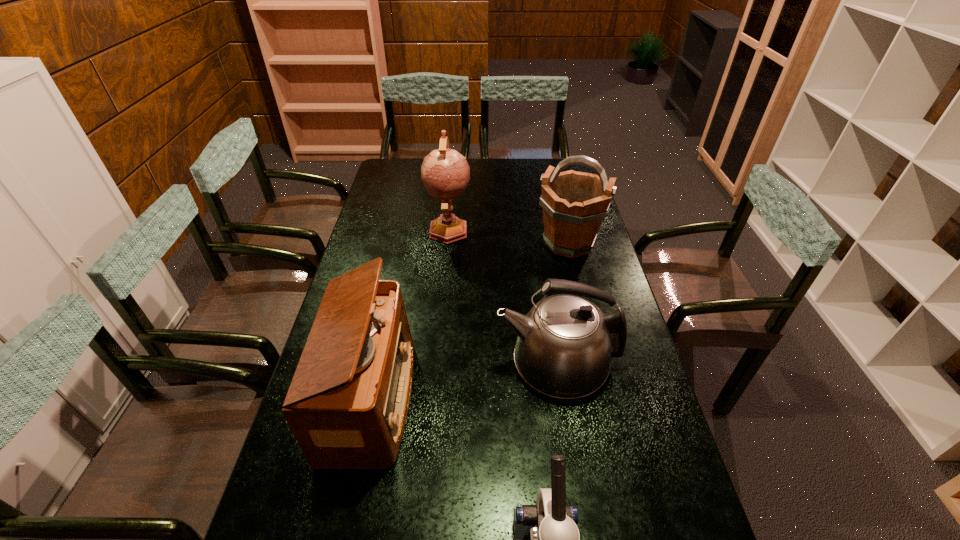
Identify which object is the third nearest to the kettle. Please provide its 2D coordinates. Your answer should be formatted as a tuple, i.e. [(x, y)], where the tuple contains the x and y coordinates of a point satisfying the conditions above.

[(574, 204)]

The height and width of the screenshot is (540, 960). Find the location of `vacant region that satisfies the following two spatial constraints: 1. on the front side of the bucket; 2. on the spout of the kettle`. vacant region that satisfies the following two spatial constraints: 1. on the front side of the bucket; 2. on the spout of the kettle is located at coordinates (597, 362).